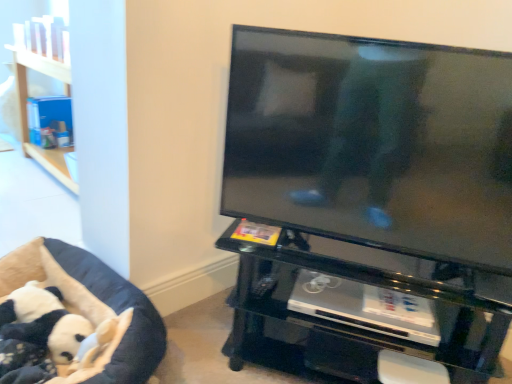
Measure the distance between black glossy tv at upper right and camera.

The distance of black glossy tv at upper right from camera is 39.11 inches.

Measure the distance between point (12,285) and camera.

1.46 meters.

The width and height of the screenshot is (512, 384). Identify the location of black glossy tv at upper right. (373, 143).

Does black plush panda at lower left have a lesser height compared to black glass tv stand at center, acting as the 2th furniture starting from the left?

Yes.

Is black plush panda at lower left further to the viewer compared to black glass tv stand at center, acting as the 2th furniture starting from the left?

Yes, the depth of black plush panda at lower left is greater than that of black glass tv stand at center, acting as the 2th furniture starting from the left.

Looking at this image, is black plush panda at lower left far away from black glass tv stand at center, acting as the first furniture starting from the right?

No, black plush panda at lower left is not far from black glass tv stand at center, acting as the first furniture starting from the right.

Would you say black plush panda at lower left is inside or outside black glass tv stand at center, acting as the 2th furniture starting from the left?

black plush panda at lower left is not enclosed by black glass tv stand at center, acting as the 2th furniture starting from the left.

Does black plush panda at lower left turn towards black plush dog bed at lower left, placed as the first furniture when sorted from left to right?

Yes, black plush panda at lower left is oriented towards black plush dog bed at lower left, placed as the first furniture when sorted from left to right.

From the image's perspective, is black plush panda at lower left on top of black plush dog bed at lower left, the second furniture in the right-to-left sequence?

No, from the image's perspective, black plush panda at lower left is not on top of black plush dog bed at lower left, the second furniture in the right-to-left sequence.

How different are the orientations of black plush panda at lower left and black plush dog bed at lower left, the second furniture in the right-to-left sequence, in degrees?

black plush panda at lower left and black plush dog bed at lower left, the second furniture in the right-to-left sequence, are facing 0.00226 degrees away from each other.

Is black plush dog bed at lower left, the second furniture in the right-to-left sequence, facing away from black glass tv stand at center, acting as the 2th furniture starting from the left?

No, black plush dog bed at lower left, the second furniture in the right-to-left sequence, is not facing the opposite direction of black glass tv stand at center, acting as the 2th furniture starting from the left.

Consider the image. From a real-world perspective, is black plush dog bed at lower left, placed as the first furniture when sorted from left to right, physically located above or below black glass tv stand at center, acting as the 2th furniture starting from the left?

In terms of real-world spatial position, black plush dog bed at lower left, placed as the first furniture when sorted from left to right, is below black glass tv stand at center, acting as the 2th furniture starting from the left.

In the scene shown: Which of these two, black plush dog bed at lower left, placed as the first furniture when sorted from left to right, or black glass tv stand at center, acting as the 2th furniture starting from the left, stands shorter?

Standing shorter between the two is black plush dog bed at lower left, placed as the first furniture when sorted from left to right.

Would you consider black plush dog bed at lower left, placed as the first furniture when sorted from left to right, to be distant from black glass tv stand at center, acting as the first furniture starting from the right?

black plush dog bed at lower left, placed as the first furniture when sorted from left to right, is near black glass tv stand at center, acting as the first furniture starting from the right, not far away.

Which is nearer, (x=99, y=288) or (x=316, y=100)?

Positioned in front is point (x=316, y=100).

In terms of size, does black plush dog bed at lower left, placed as the first furniture when sorted from left to right, appear bigger or smaller than black glossy tv at upper right?

Considering their sizes, black plush dog bed at lower left, placed as the first furniture when sorted from left to right, takes up more space than black glossy tv at upper right.

Is black plush dog bed at lower left, placed as the first furniture when sorted from left to right, not close to black glossy tv at upper right?

No, black plush dog bed at lower left, placed as the first furniture when sorted from left to right, is not far away from black glossy tv at upper right.

Where is `television lying on the right of black plush panda at lower left`? Image resolution: width=512 pixels, height=384 pixels. television lying on the right of black plush panda at lower left is located at coordinates (373, 143).

Is black plush panda at lower left facing towards black glossy tv at upper right?

No, black plush panda at lower left does not turn towards black glossy tv at upper right.

Looking at this image, would you say black plush panda at lower left contains black glossy tv at upper right?

No, black glossy tv at upper right is located outside of black plush panda at lower left.

Does black plush panda at lower left touch black glossy tv at upper right?

black plush panda at lower left and black glossy tv at upper right are not in contact.

Identify the location of panda behind the black glass tv stand at center, acting as the 2th furniture starting from the left. (42, 321).

Is point (336, 279) closer or farther from the camera than point (12, 312)?

Point (336, 279) appears to be farther away from the viewer than point (12, 312).

Considering their positions, is black glass tv stand at center, acting as the first furniture starting from the right, located in front of or behind black plush panda at lower left?

Visually, black glass tv stand at center, acting as the first furniture starting from the right, is located in front of black plush panda at lower left.

How different are the orientations of black glossy tv at upper right and black plush dog bed at lower left, placed as the first furniture when sorted from left to right, in degrees?

There is a 23.1-degree angle between the facing directions of black glossy tv at upper right and black plush dog bed at lower left, placed as the first furniture when sorted from left to right.

This screenshot has height=384, width=512. I want to click on television that is on the right side of black plush dog bed at lower left, the second furniture in the right-to-left sequence, so click(373, 143).

In the image, is black glossy tv at upper right positioned in front of or behind black plush dog bed at lower left, the second furniture in the right-to-left sequence?

In the image, black glossy tv at upper right appears in front of black plush dog bed at lower left, the second furniture in the right-to-left sequence.

Is black glossy tv at upper right next to black plush dog bed at lower left, placed as the first furniture when sorted from left to right?

No, black glossy tv at upper right is not next to black plush dog bed at lower left, placed as the first furniture when sorted from left to right.

At what (x,y) coordinates should I click in order to perform the action: click on panda that is on the left side of black glass tv stand at center, acting as the first furniture starting from the right. Please return your answer as a coordinate pair (x, y). The height and width of the screenshot is (384, 512). Looking at the image, I should click on (42, 321).

From the black plush panda at lower left, count 1st furniture to the right and point to it. Please provide its 2D coordinates.

[(93, 302)]

From the image, which object appears to be nearer to black plush dog bed at lower left, placed as the first furniture when sorted from left to right, black glossy tv at upper right or black glass tv stand at center, acting as the 2th furniture starting from the left?

black glass tv stand at center, acting as the 2th furniture starting from the left.

Based on their spatial positions, is black plush dog bed at lower left, placed as the first furniture when sorted from left to right, or black glossy tv at upper right further from black glass tv stand at center, acting as the 2th furniture starting from the left?

black plush dog bed at lower left, placed as the first furniture when sorted from left to right.

When comparing their distances from black glossy tv at upper right, does black glass tv stand at center, acting as the first furniture starting from the right, or black plush panda at lower left seem further?

black plush panda at lower left is positioned further to the anchor black glossy tv at upper right.

Estimate the real-world distances between objects in this image. Which object is closer to black glossy tv at upper right, black plush dog bed at lower left, the second furniture in the right-to-left sequence, or black glass tv stand at center, acting as the first furniture starting from the right?

black glass tv stand at center, acting as the first furniture starting from the right, lies closer to black glossy tv at upper right than the other object.

Estimate the real-world distances between objects in this image. Which object is closer to black glass tv stand at center, acting as the 2th furniture starting from the left, black glossy tv at upper right or black plush dog bed at lower left, the second furniture in the right-to-left sequence?

black glossy tv at upper right is closer to black glass tv stand at center, acting as the 2th furniture starting from the left.

Estimate the real-world distances between objects in this image. Which object is closer to black plush panda at lower left, black glossy tv at upper right or black plush dog bed at lower left, the second furniture in the right-to-left sequence?

The object closer to black plush panda at lower left is black plush dog bed at lower left, the second furniture in the right-to-left sequence.

Which object lies further to the anchor point black glass tv stand at center, acting as the first furniture starting from the right, black plush panda at lower left or black plush dog bed at lower left, placed as the first furniture when sorted from left to right?

Among the two, black plush panda at lower left is located further to black glass tv stand at center, acting as the first furniture starting from the right.

Which object lies nearer to the anchor point black plush panda at lower left, black glass tv stand at center, acting as the first furniture starting from the right, or black plush dog bed at lower left, placed as the first furniture when sorted from left to right?

Based on the image, black plush dog bed at lower left, placed as the first furniture when sorted from left to right, appears to be nearer to black plush panda at lower left.

Identify the location of furniture between black plush panda at lower left and black glass tv stand at center, acting as the 2th furniture starting from the left, in the horizontal direction. Image resolution: width=512 pixels, height=384 pixels. (93, 302).

Find the location of `television between black plush dog bed at lower left, the second furniture in the right-to-left sequence, and black glass tv stand at center, acting as the 2th furniture starting from the left, in the horizontal direction`. television between black plush dog bed at lower left, the second furniture in the right-to-left sequence, and black glass tv stand at center, acting as the 2th furniture starting from the left, in the horizontal direction is located at coordinates (373, 143).

I want to click on furniture between black plush panda at lower left and black glossy tv at upper right from left to right, so click(x=93, y=302).

This screenshot has height=384, width=512. Identify the location of television between black plush panda at lower left and black glass tv stand at center, acting as the 2th furniture starting from the left, in the horizontal direction. (373, 143).